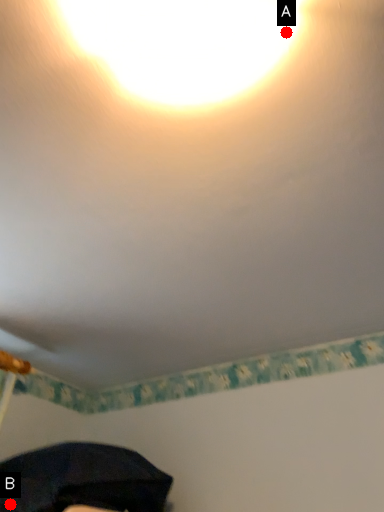
Question: Two points are circled on the image, labeled by A and B beside each circle. Which point appears farthest from the camera in this image?

Choices:
 (A) A is further
 (B) B is further

Answer: (B)